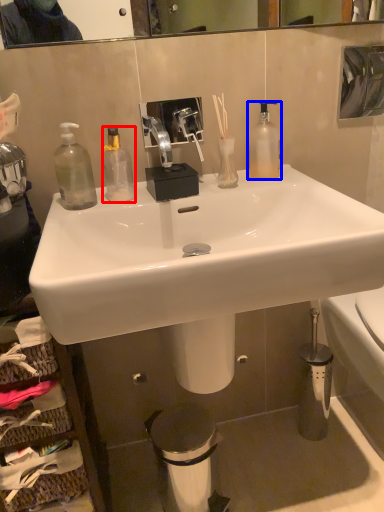
Question: Which point is closer to the camera, bottle (highlighted by a red box) or bottle (highlighted by a blue box)?

Choices:
 (A) bottle
 (B) bottle

Answer: (A)